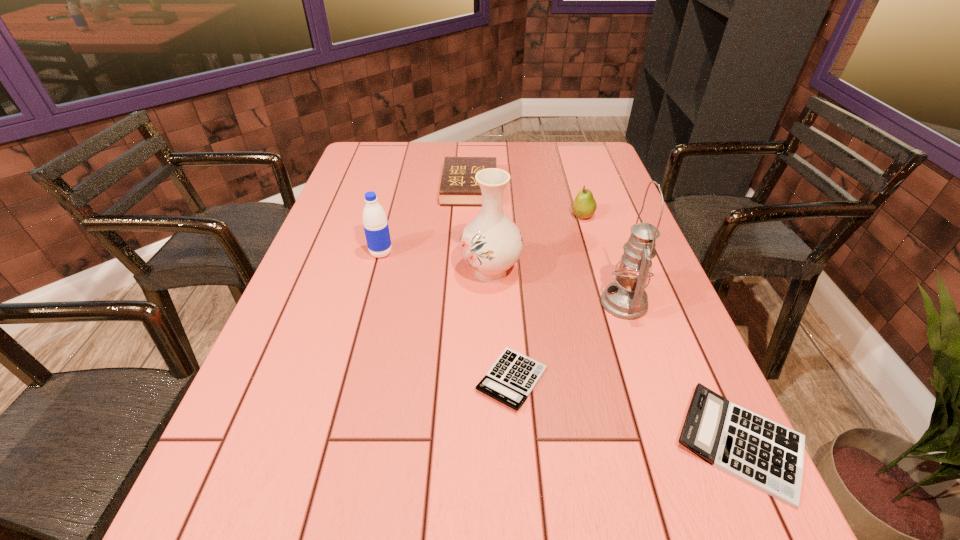
I want to click on the fifth shortest object, so click(375, 223).

Locate an element on the screen. The height and width of the screenshot is (540, 960). the second tallest object is located at coordinates point(491,243).

The height and width of the screenshot is (540, 960). Find the location of `vacant space located on the left of the left calculator`. vacant space located on the left of the left calculator is located at coordinates (299, 380).

You are a GUI agent. You are given a task and a screenshot of the screen. Output one action in this format:
    pyautogui.click(x=<x>, y=<y>)
    Task: Click on the blank space located 0.200m on the left of the sixth tallest object
    This screenshot has width=960, height=540.
    Given the screenshot: What is the action you would take?
    pyautogui.click(x=564, y=443)

At what (x,y) coordinates should I click in order to perform the action: click on free region located on the left of the farthest object. Please return your answer as a coordinate pair (x, y). Looking at the image, I should click on (381, 187).

The width and height of the screenshot is (960, 540). Find the location of `vacant space situated on the back of the second farthest object`. vacant space situated on the back of the second farthest object is located at coordinates (565, 160).

This screenshot has height=540, width=960. Find the location of `vacant space located on the back of the oil lamp`. vacant space located on the back of the oil lamp is located at coordinates (589, 201).

Locate an element on the screen. Image resolution: width=960 pixels, height=540 pixels. free space located on the right of the third tallest object is located at coordinates (473, 253).

The image size is (960, 540). In order to click on vacant space situated 0.120m on the back of the sixth shortest object in this screenshot , I will do `click(490, 227)`.

I want to click on object situated at the far edge, so click(458, 187).